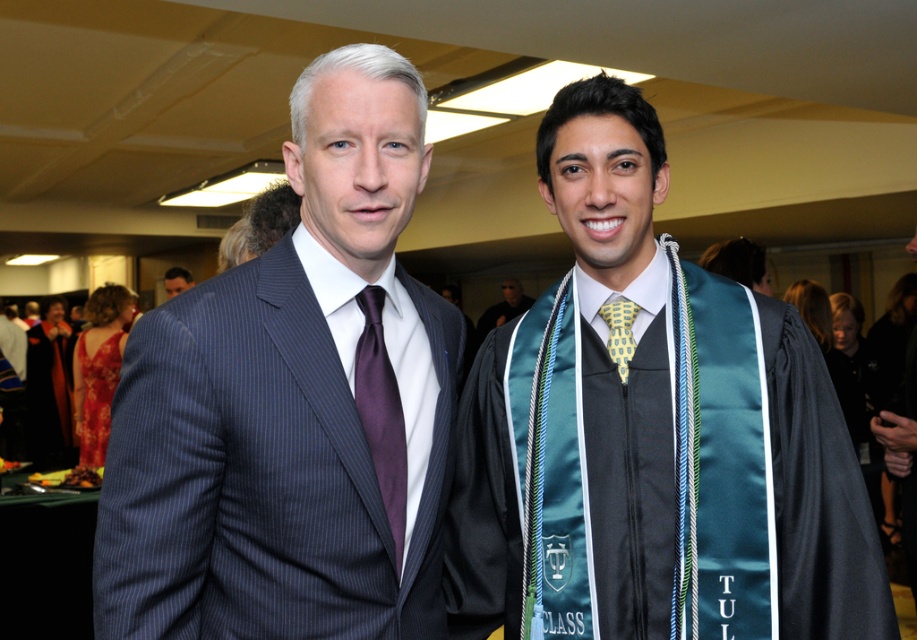
Which of these two, matte black suit at left or shiny red dress at left, stands taller?

matte black suit at left is taller.

Who is positioned more to the left, matte black suit at left or shiny red dress at left?

matte black suit at left

What are the coordinates of `matte black suit at left` in the screenshot? It's located at (48, 385).

Is purple satin tie at center bigger than shiny red dress at left?

Actually, purple satin tie at center might be smaller than shiny red dress at left.

Is purple satin tie at center to the left of shiny red dress at left from the viewer's perspective?

In fact, purple satin tie at center is to the right of shiny red dress at left.

Who is more forward, (x=368, y=410) or (x=106, y=369)?

Point (x=368, y=410) is more forward.

Where is `purple satin tie at center`? purple satin tie at center is located at coordinates (381, 413).

Between shiny red dress at left and matte black suit at center, which one appears on the left side from the viewer's perspective?

shiny red dress at left

Between point (83, 410) and point (481, 321), which one is positioned behind?

The point (481, 321) is more distant.

Is point (83, 353) farther from viewer compared to point (505, 321)?

No, it is not.

Where is `shiny red dress at left`? shiny red dress at left is located at coordinates (97, 396).